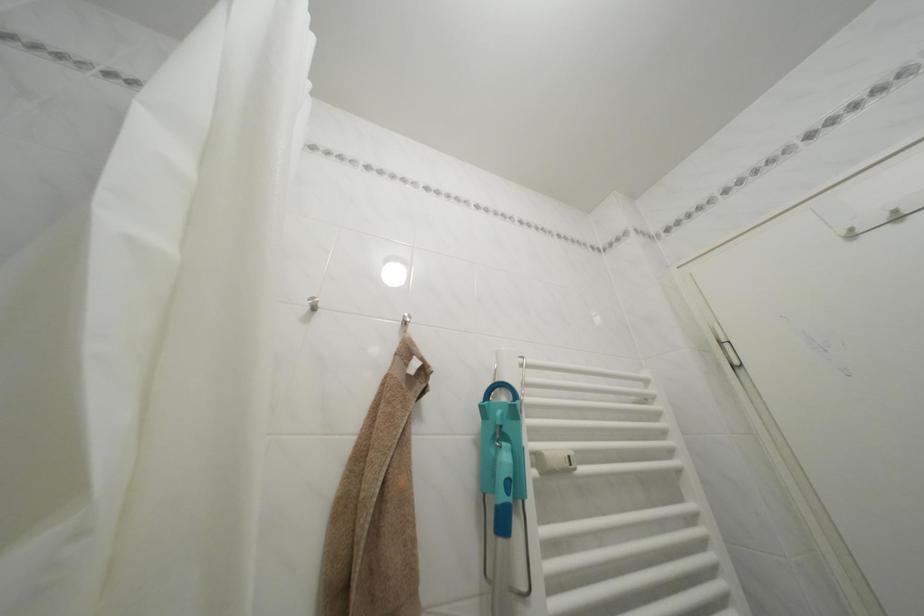
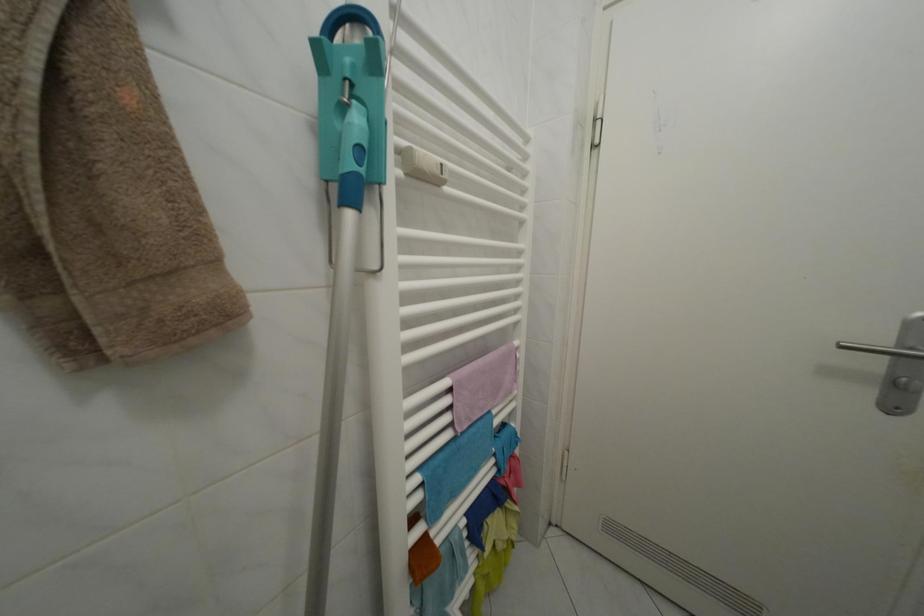
Where in the second image is the point corresponding to the point at 541,472 from the first image?

(406, 172)